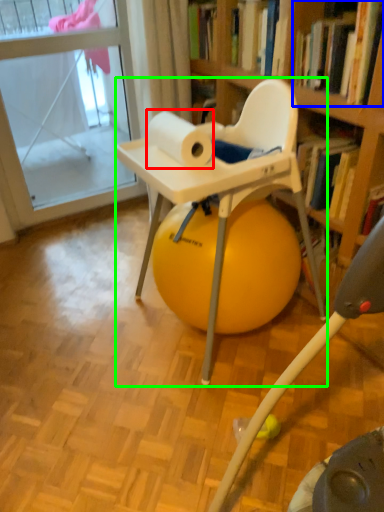
Question: Which object is positioned closest to paper towel (highlighted by a red box)? Select from book (highlighted by a blue box) and chair (highlighted by a green box).

Choices:
 (A) book
 (B) chair

Answer: (B)